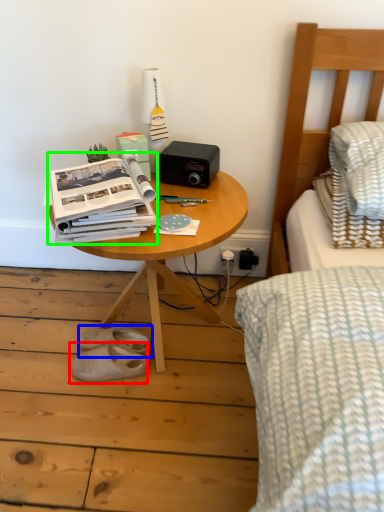
Question: Considering the real-world distances, which object is farthest from footwear (highlighted by a red box)? footwear (highlighted by a blue box) or paperback book (highlighted by a green box)?

Choices:
 (A) footwear
 (B) paperback book

Answer: (B)